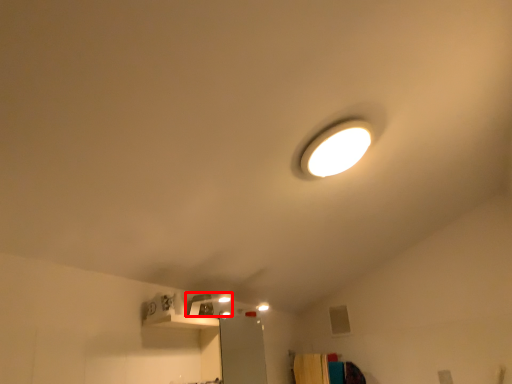
Question: From the image, what is the correct spatial relationship of lamp (annotated by the red box) in relation to furniture?

Choices:
 (A) left
 (B) right

Answer: (A)